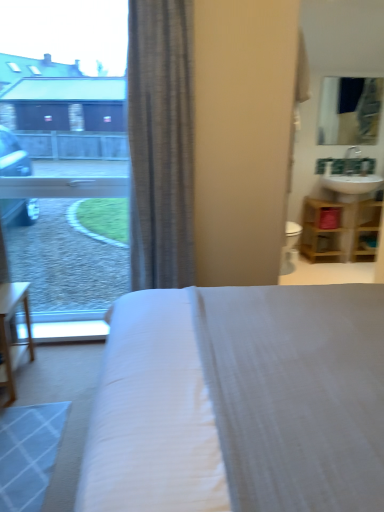
Question: Is white fabric bed at center spatially inside transparent glass window at upper left, or outside of it?

Choices:
 (A) outside
 (B) inside

Answer: (A)

Question: From a real-world perspective, is white fabric bed at center positioned above or below transparent glass window at upper left?

Choices:
 (A) below
 (B) above

Answer: (A)

Question: Which is farther from the white fabric bed at center?

Choices:
 (A) matte glass mirror at upper right
 (B) wooden shelf at right
 (C) gray textured curtain at center
 (D) transparent glass window at upper left

Answer: (A)

Question: Estimate the real-world distances between objects in this image. Which object is closer to the transparent glass window at upper left?

Choices:
 (A) white fabric bed at center
 (B) matte glass mirror at upper right
 (C) wooden shelf at right
 (D) gray textured curtain at center

Answer: (D)